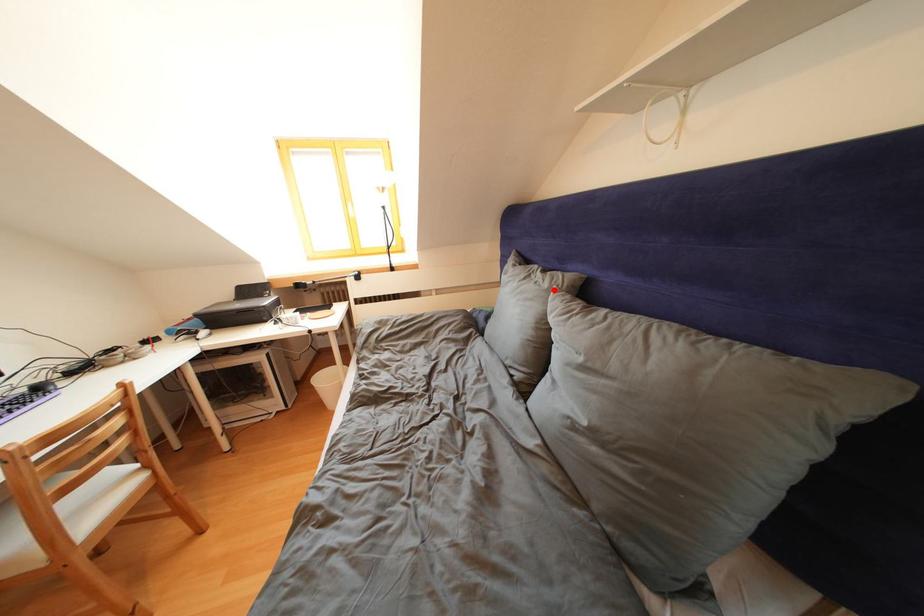
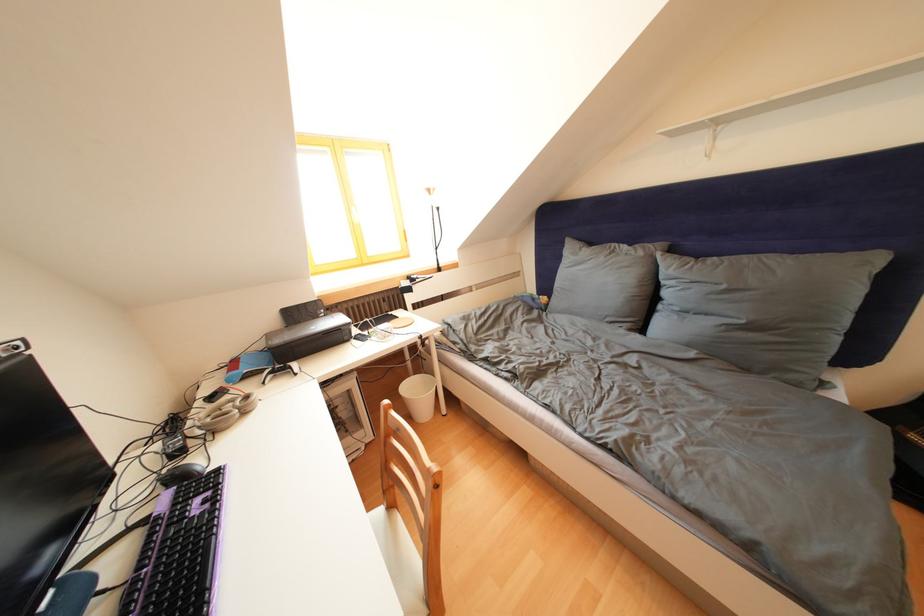
Where in the second image is the point corresponding to the highlighted location from the first image?

(649, 259)